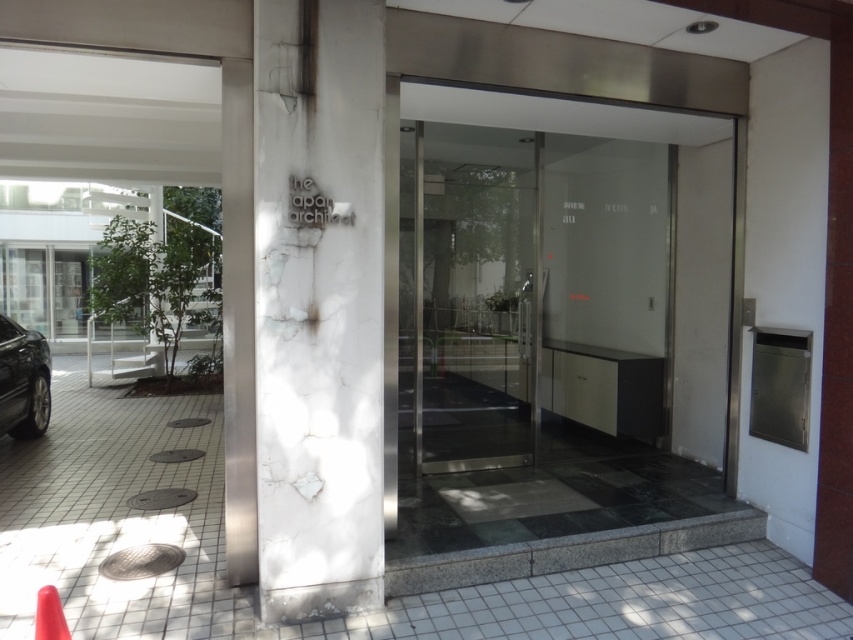
Question: Among these objects, which one is farthest from the camera?

Choices:
 (A) transparent glass door at center
 (B) white marble pillar at center

Answer: (A)

Question: Is transparent glass door at center above rubber orange cone at lower left?

Choices:
 (A) no
 (B) yes

Answer: (B)

Question: Which point appears farthest from the camera in this image?

Choices:
 (A) [45, 627]
 (B) [627, 451]

Answer: (B)

Question: Is transparent glass elevator at center further to camera compared to transparent glass door at center?

Choices:
 (A) yes
 (B) no

Answer: (A)

Question: Does transparent glass door at center have a greater width compared to rubber orange cone at lower left?

Choices:
 (A) yes
 (B) no

Answer: (A)

Question: Which object is closer to the camera taking this photo?

Choices:
 (A) transparent glass elevator at center
 (B) shiny black car at lower left
 (C) rubber orange cone at lower left
 (D) white marble pillar at center

Answer: (C)